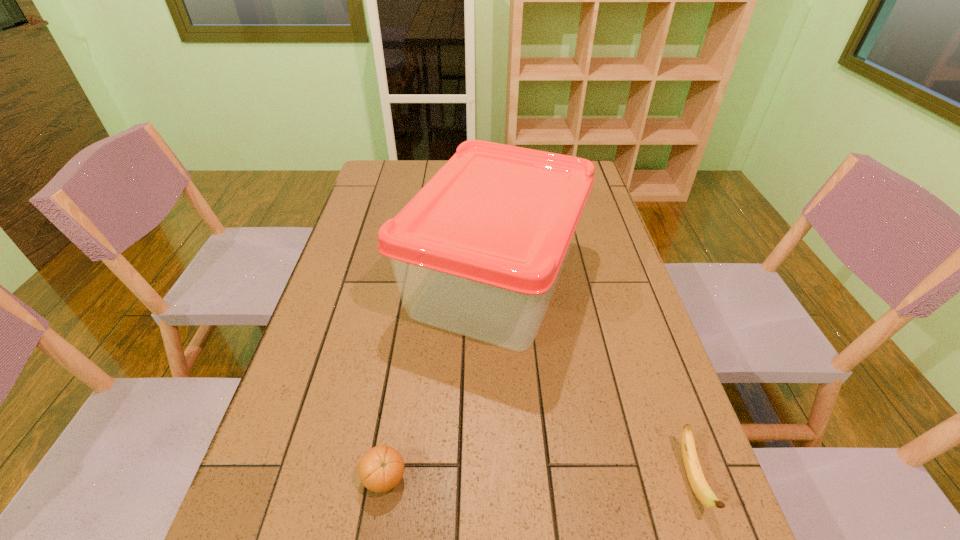
Locate an element on the screen. The width and height of the screenshot is (960, 540). object that is the nearest to the banana is located at coordinates (479, 250).

Find the location of a particular element. The width and height of the screenshot is (960, 540). object that can be found as the second closest to the orange is located at coordinates (695, 475).